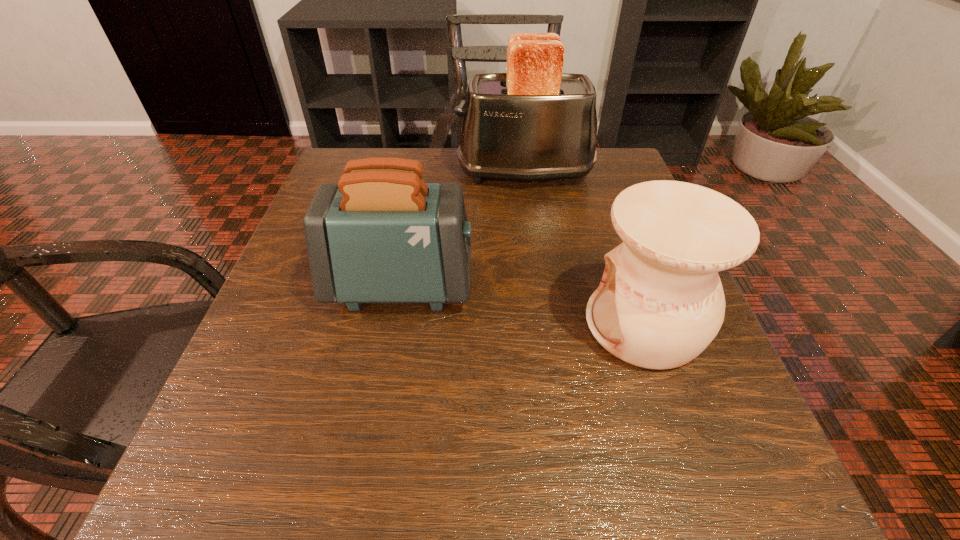
Find the location of `free point located 0.280m at the open side of the pottery`. free point located 0.280m at the open side of the pottery is located at coordinates (410, 324).

Locate an element on the screen. The height and width of the screenshot is (540, 960). object positioned at the far edge is located at coordinates (534, 122).

You are a GUI agent. You are given a task and a screenshot of the screen. Output one action in this format:
    pyautogui.click(x=<x>, y=<y>)
    Task: Click on the object that is at the left edge
    The image size is (960, 540).
    Given the screenshot: What is the action you would take?
    pyautogui.click(x=381, y=234)

This screenshot has height=540, width=960. I want to click on toaster that is at the right edge, so click(534, 122).

Find the location of a particular element. pottery present at the right edge is located at coordinates (660, 303).

Where is `object that is at the far right corner`? The height and width of the screenshot is (540, 960). object that is at the far right corner is located at coordinates (534, 122).

The height and width of the screenshot is (540, 960). In order to click on vacant space at the far edge of the desktop in this screenshot , I will do `click(451, 157)`.

I want to click on free space at the near edge, so click(x=430, y=492).

Find the location of a particular element. vacant space at the left edge of the desktop is located at coordinates (304, 260).

At what (x,y) coordinates should I click in order to perform the action: click on vacant point at the right edge. Please return your answer as a coordinate pair (x, y). Image resolution: width=960 pixels, height=540 pixels. Looking at the image, I should click on (611, 216).